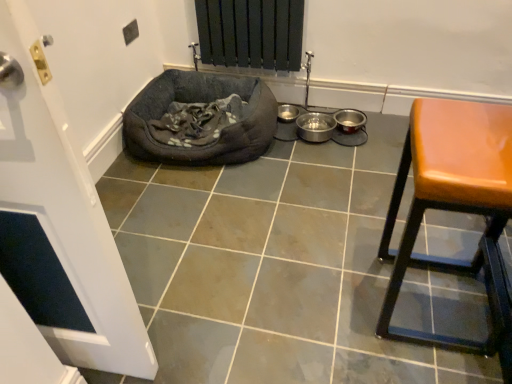
You are a GUI agent. You are given a task and a screenshot of the screen. Output one action in this format:
    pyautogui.click(x=<x>, y=<y>)
    Task: Click on the vacant space situated above matte gray tile at center (from a real-world perspective)
    This screenshot has height=384, width=512.
    Given the screenshot: What is the action you would take?
    pyautogui.click(x=280, y=234)